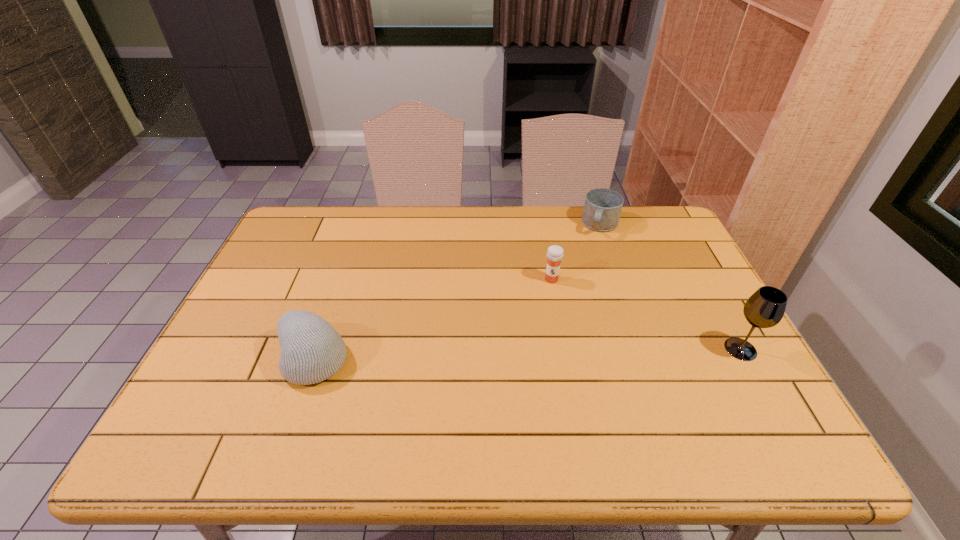
The image size is (960, 540). Find the location of `free space at the left edge of the desktop`. free space at the left edge of the desktop is located at coordinates (253, 322).

In the image, there is a desktop. Where is `vacant space at the right edge`? vacant space at the right edge is located at coordinates (666, 258).

In the image, there is a desktop. At what (x,y) coordinates should I click in order to perform the action: click on blank space at the far left corner. Please return your answer as a coordinate pair (x, y). Image resolution: width=960 pixels, height=540 pixels. Looking at the image, I should click on (337, 213).

At what (x,y) coordinates should I click in order to perform the action: click on unoccupied area between the mug and the second farthest object. Please return your answer as a coordinate pair (x, y). The image size is (960, 540). Looking at the image, I should click on (576, 252).

You are a GUI agent. You are given a task and a screenshot of the screen. Output one action in this format:
    pyautogui.click(x=<x>, y=<y>)
    Task: Click on the free space that is in between the farthest object and the medicine
    The image size is (960, 540).
    Given the screenshot: What is the action you would take?
    pyautogui.click(x=576, y=252)

Identify the location of vacant space that's between the beanie and the second object from left to right. (433, 319).

Find the location of `vacant region between the farthest object and the beanie`. vacant region between the farthest object and the beanie is located at coordinates (457, 292).

Identify the location of unoccupied area between the third object from left to right and the wineglass. The image size is (960, 540). (671, 287).

Where is `vacant space that is in between the leftmost object and the mug`? The image size is (960, 540). vacant space that is in between the leftmost object and the mug is located at coordinates [457, 292].

Where is `free space between the tallest object and the mug`? This screenshot has width=960, height=540. free space between the tallest object and the mug is located at coordinates (671, 287).